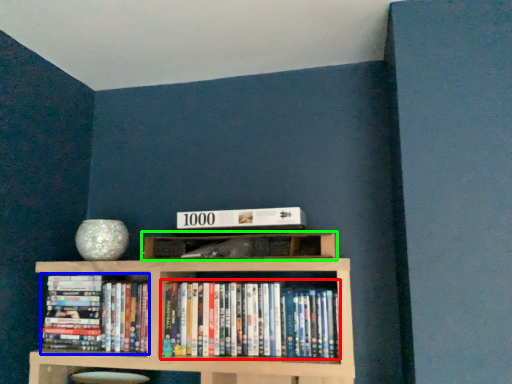
Question: Which is nearer to the book (highlighted by a red box)? book (highlighted by a blue box) or shelf (highlighted by a green box).

Choices:
 (A) book
 (B) shelf

Answer: (B)